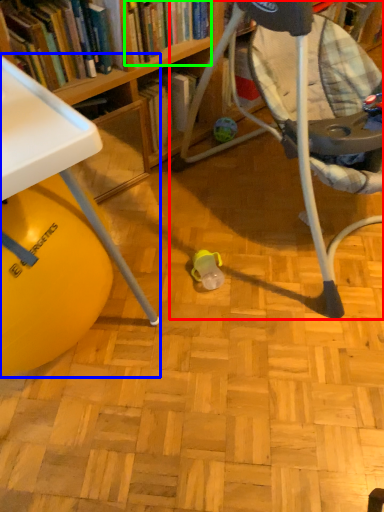
Question: Which object is positioned farthest from chair (highlighted by a red box)? Select from table (highlighted by a blue box) and book (highlighted by a green box).

Choices:
 (A) table
 (B) book

Answer: (A)